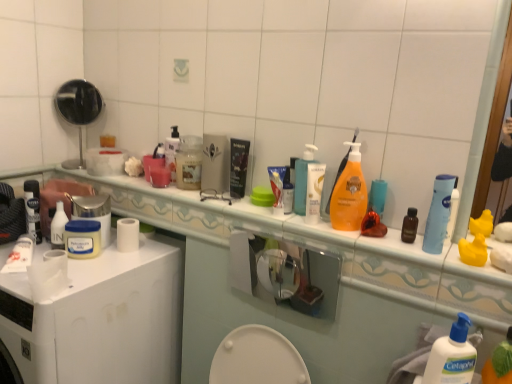
Locate an element on the screen. The image size is (512, 384). free spot in front of white plastic jar at upper left, arranged as the second mouthwash when viewed from the back is located at coordinates (79, 278).